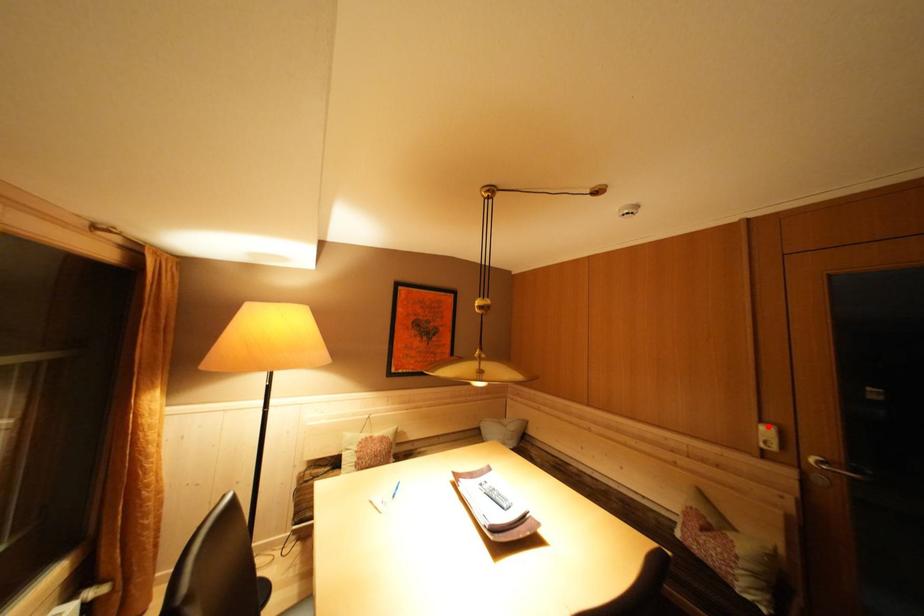
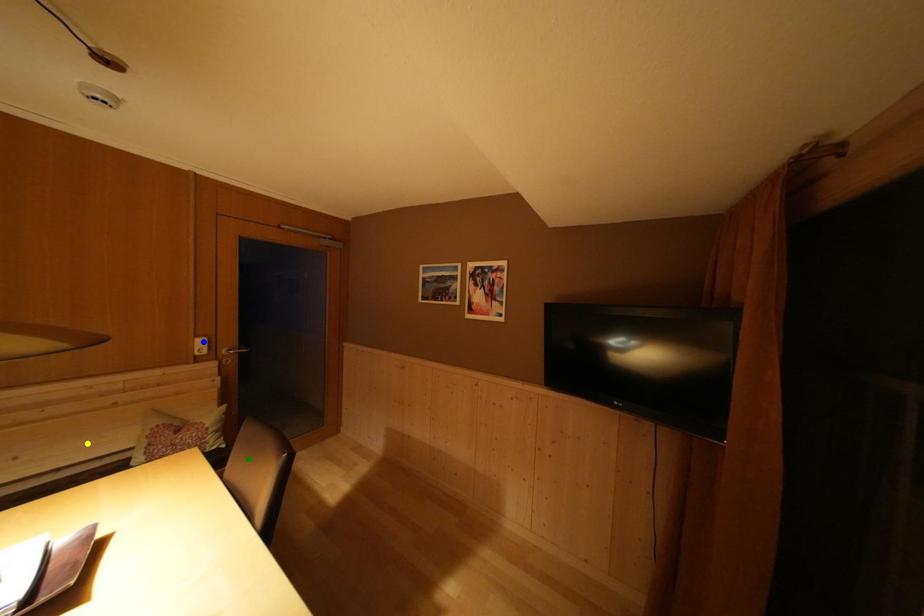
Question: I am providing you with two images of the same scene from different viewpoints. A red point is marked on the first image. You are given multiple points on the second image. In image 2, which mark is for the same physical point as the one in image 1?

Choices:
 (A) yellow point
 (B) green point
 (C) blue point

Answer: (C)